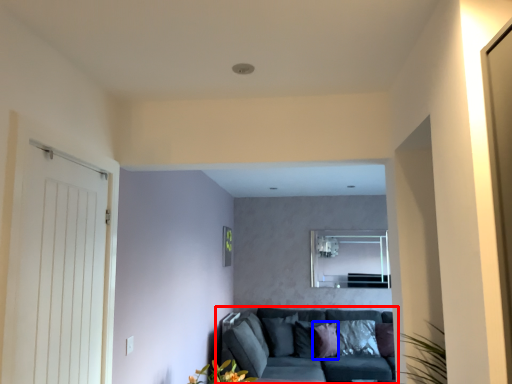
Question: Which object is closer to the camera taking this photo, studio couch (highlighted by a red box) or pillow (highlighted by a blue box)?

Choices:
 (A) studio couch
 (B) pillow

Answer: (A)